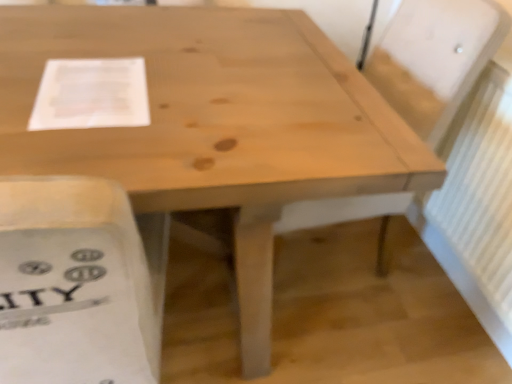
This screenshot has height=384, width=512. What are the coordinates of `free space to the left of white paper at upper left` in the screenshot? It's located at (23, 68).